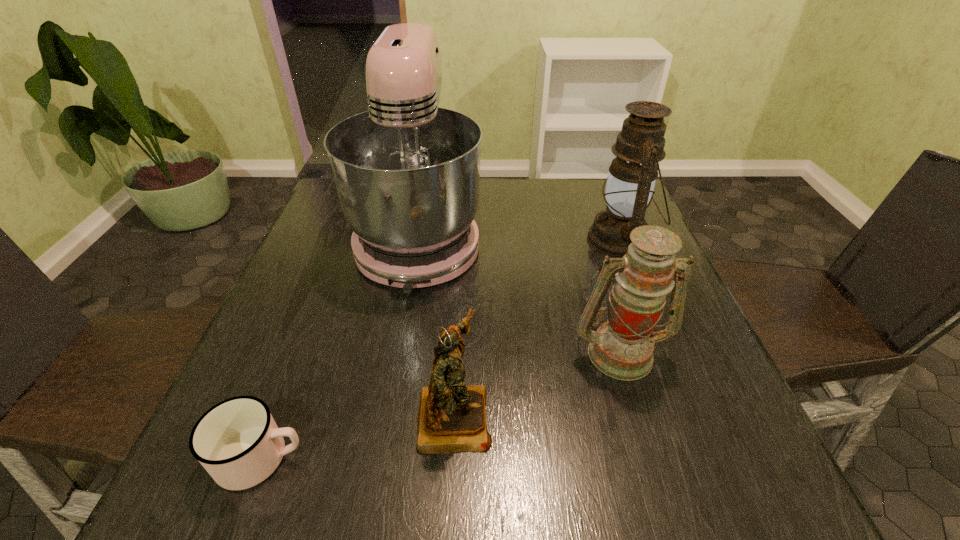
Find the location of `blank space located on the front-facing side of the figurine`. blank space located on the front-facing side of the figurine is located at coordinates (690, 415).

Image resolution: width=960 pixels, height=540 pixels. What are the coordinates of `vacant space located 0.400m on the side of the shortest object with the handle` in the screenshot? It's located at (560, 458).

Where is `mixer that is at the far edge`? Image resolution: width=960 pixels, height=540 pixels. mixer that is at the far edge is located at coordinates (407, 172).

Locate an element on the screen. oil lamp that is at the far edge is located at coordinates 630,184.

Where is `figurine present at the near edge`? The height and width of the screenshot is (540, 960). figurine present at the near edge is located at coordinates (452, 418).

I want to click on mug located at the near edge, so click(x=237, y=441).

This screenshot has height=540, width=960. In order to click on mixer that is at the left edge in this screenshot , I will do `click(407, 172)`.

Find the location of a particular element. mug that is at the left edge is located at coordinates (237, 441).

This screenshot has height=540, width=960. I want to click on object located in the far left corner section of the desktop, so click(x=407, y=172).

Locate an element on the screen. object that is at the near left corner is located at coordinates (237, 441).